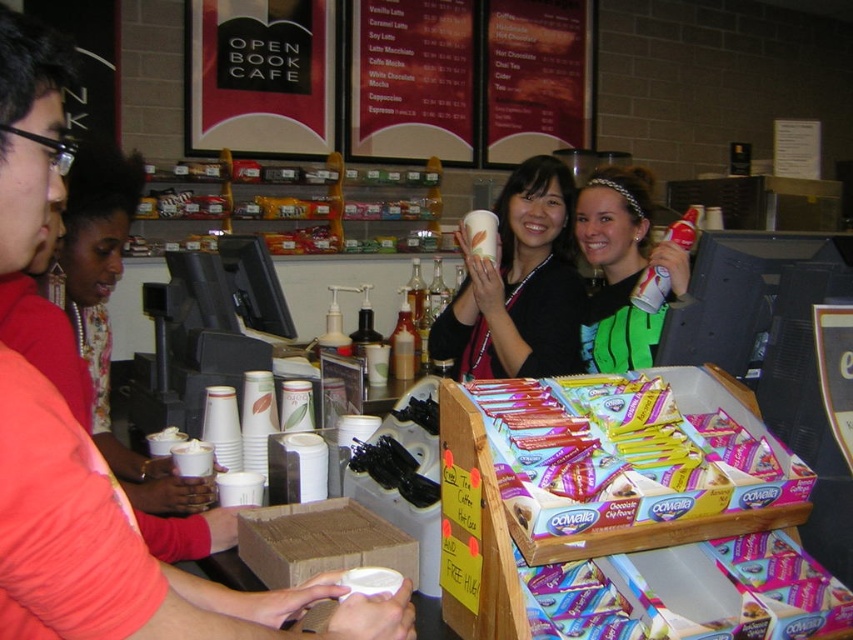
You are a barista at the Open Book Cafe. You see a customer holding a matte white cup at center and another customer wearing a green fabric shirt at center. Which object is smaller in size?

The matte white cup at center is smaller in size compared to the green fabric shirt at center.

You are a customer at the Open Book Cafe. You see a matte white cup at center and a green fabric shirt at center. Which item is higher up?

The matte white cup at center is above the green fabric shirt at center, so the matte white cup at center is higher up.